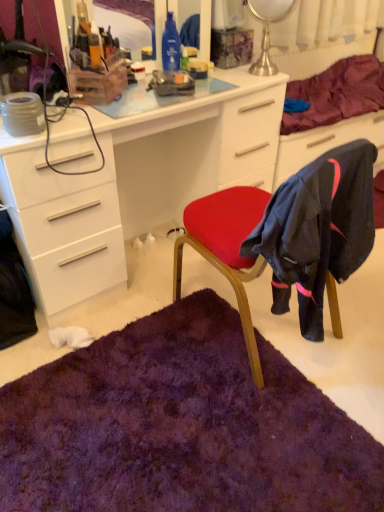
Question: From their relative heights in the image, would you say white glossy desk at center is taller or shorter than clear plastic organizer at upper center?

Choices:
 (A) short
 (B) tall

Answer: (B)

Question: Is white glossy desk at center bigger or smaller than clear plastic organizer at upper center?

Choices:
 (A) small
 (B) big

Answer: (B)

Question: Which of these objects is positioned farthest from the purple soft fabric at upper right?

Choices:
 (A) white glossy desk at center
 (B) clear plastic organizer at upper center
 (C) velvet red chair at center
 (D) metallic silver table lamp at upper center
 (E) purple shaggy rug at lower center

Answer: (E)

Question: Which object is the closest to the velvet red chair at center?

Choices:
 (A) clear plastic organizer at upper center
 (B) purple shaggy rug at lower center
 (C) metallic silver table lamp at upper center
 (D) white glossy desk at center
 (E) purple soft fabric at upper right

Answer: (B)